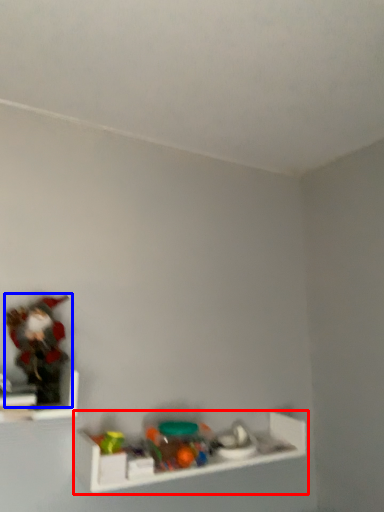
Question: Which of the following is the farthest to the observer, shelf (highlighted by a red box) or toy (highlighted by a blue box)?

Choices:
 (A) shelf
 (B) toy

Answer: (A)